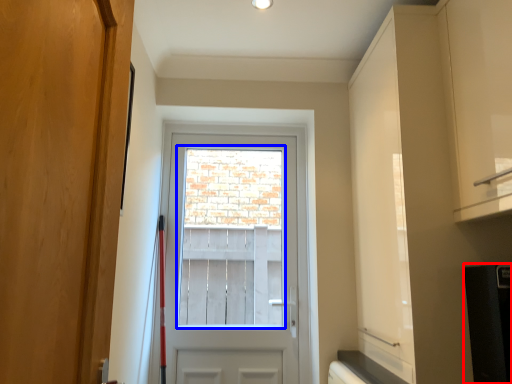
Question: Which object is further to the camera taking this photo, appliance (highlighted by a red box) or window screen (highlighted by a blue box)?

Choices:
 (A) appliance
 (B) window screen

Answer: (B)